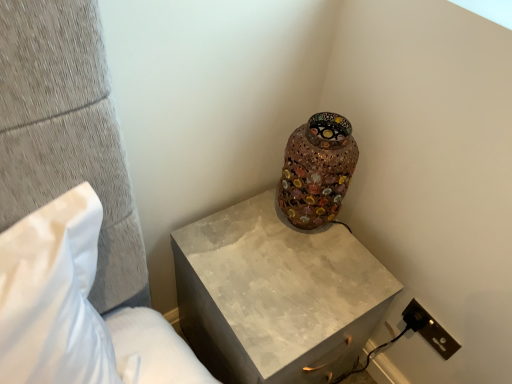
Question: In terms of height, does white fabric pillow at left look taller or shorter compared to matte concrete nightstand at upper right?

Choices:
 (A) tall
 (B) short

Answer: (A)

Question: Considering the relative positions of white fabric pillow at left and matte concrete nightstand at upper right in the image provided, is white fabric pillow at left to the left or to the right of matte concrete nightstand at upper right?

Choices:
 (A) right
 (B) left

Answer: (B)

Question: Based on their relative distances, which object is nearer to the mosaic glass vase at upper right?

Choices:
 (A) matte concrete nightstand at upper right
 (B) white fabric pillow at left
 (C) brown plastic electrical outlet at lower right

Answer: (A)

Question: Which of these objects is positioned farthest from the mosaic glass vase at upper right?

Choices:
 (A) matte concrete nightstand at upper right
 (B) brown plastic electrical outlet at lower right
 (C) white fabric pillow at left

Answer: (C)